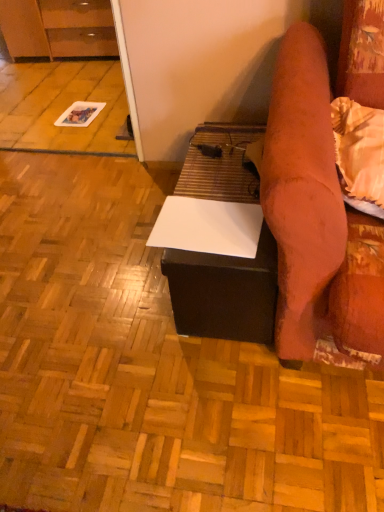
Question: In terms of size, does white matte paper at center appear bigger or smaller than matte brown cabinet at upper left?

Choices:
 (A) small
 (B) big

Answer: (A)

Question: Relative to matte brown cabinet at upper left, is white matte paper at center in front or behind?

Choices:
 (A) behind
 (B) front

Answer: (B)

Question: Which object is positioned farthest from the matte brown cabinet at upper left?

Choices:
 (A) white matte table at center
 (B) white matte paper at center

Answer: (A)

Question: Which is nearer to the white matte table at center?

Choices:
 (A) matte brown cabinet at upper left
 (B) white matte paper at center

Answer: (B)